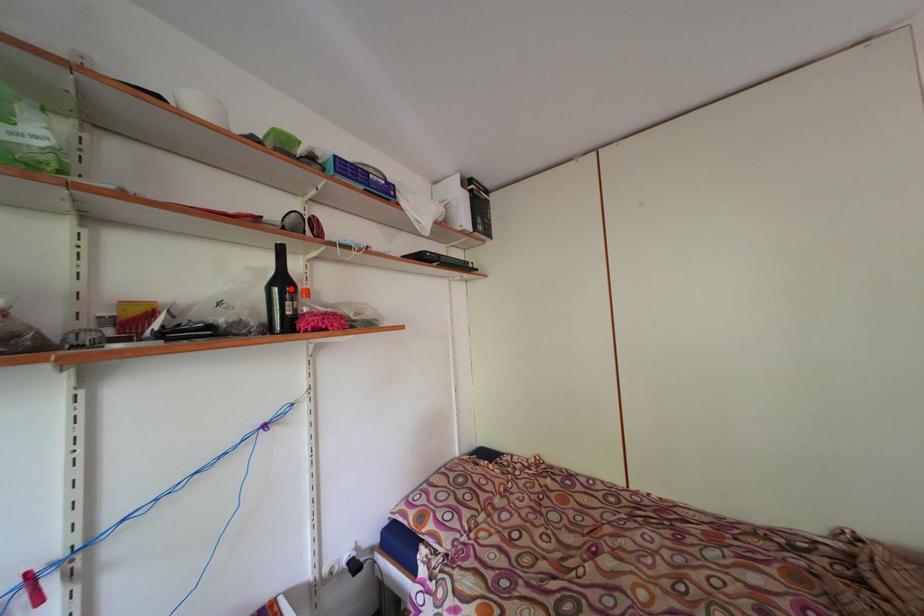
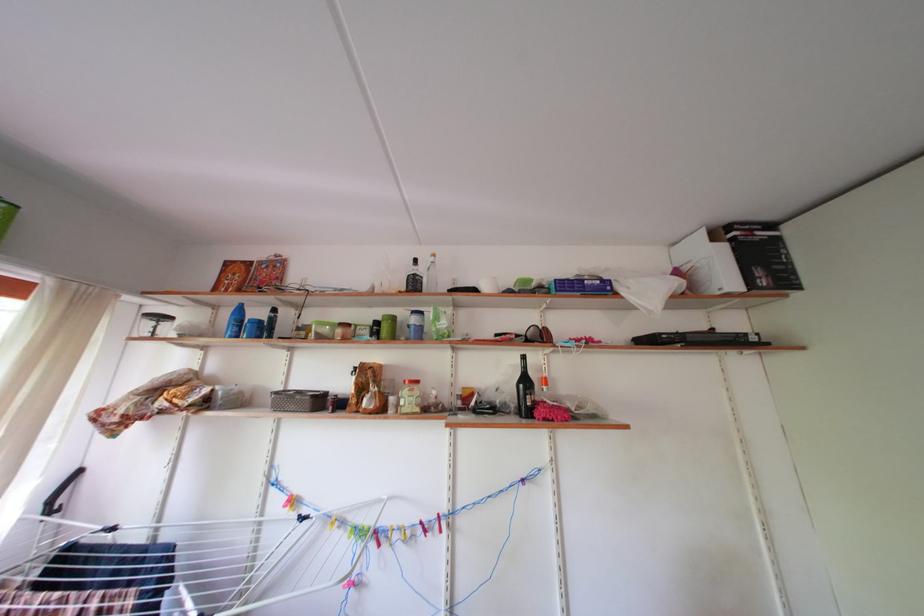
In the second image, find the point that corresponds to the highlighted location in the first image.

(533, 387)